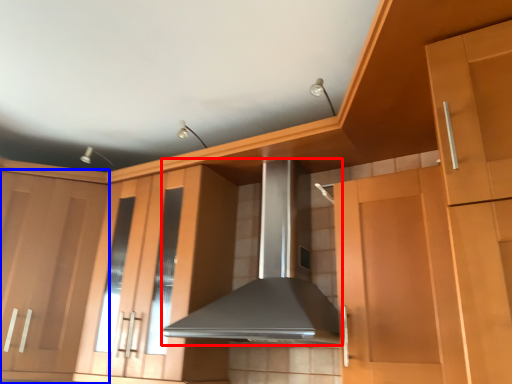
Question: Among these objects, which one is farthest to the camera, home appliance (highlighted by a red box) or cabinetry (highlighted by a blue box)?

Choices:
 (A) home appliance
 (B) cabinetry

Answer: (B)